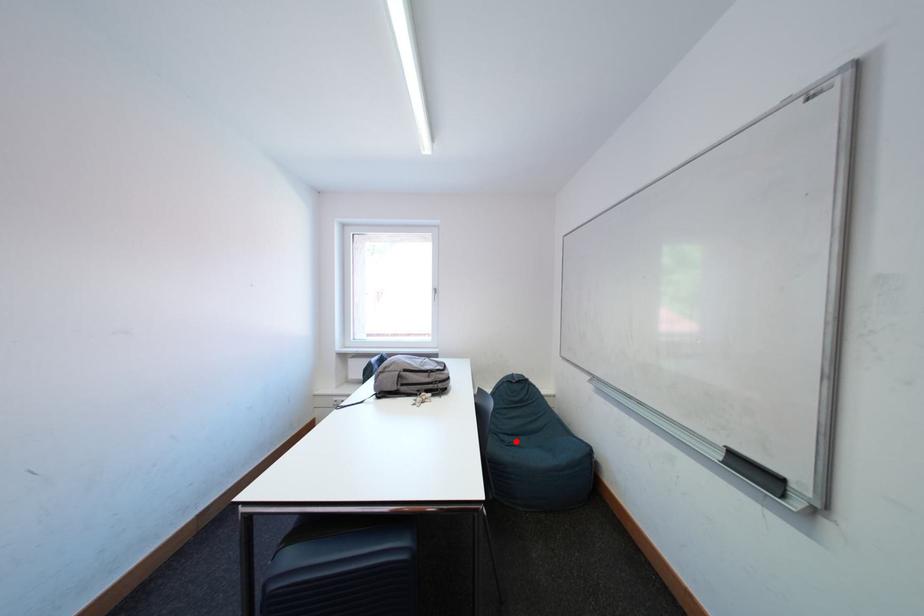
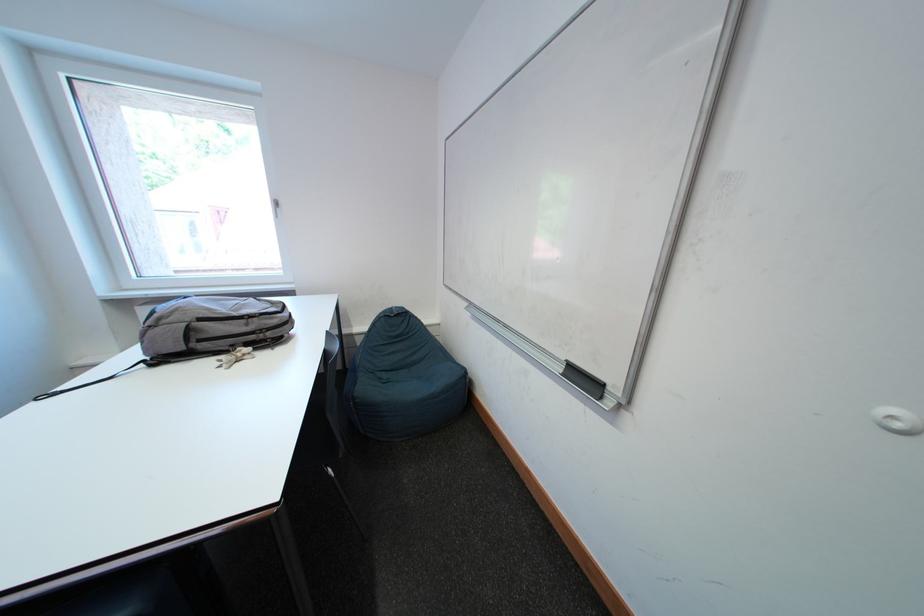
Where in the second image is the point corresponding to the highlighted location from the first image?

(394, 379)